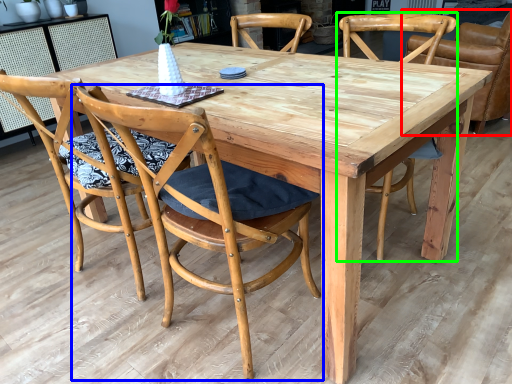
Question: Estimate the real-world distances between objects in this image. Which object is closer to chair (highlighted by a red box), chair (highlighted by a blue box) or chair (highlighted by a green box)?

Choices:
 (A) chair
 (B) chair

Answer: (B)